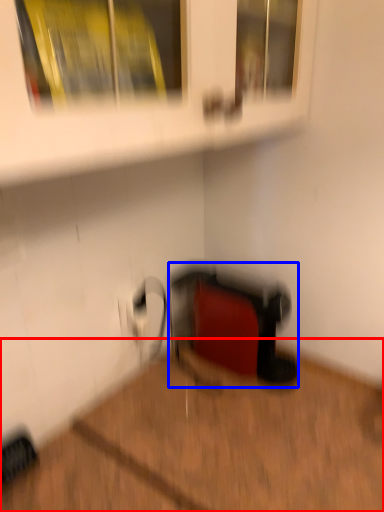
Question: Among these objects, which one is farthest to the camera, hardwood (highlighted by a red box) or wide (highlighted by a blue box)?

Choices:
 (A) hardwood
 (B) wide

Answer: (B)